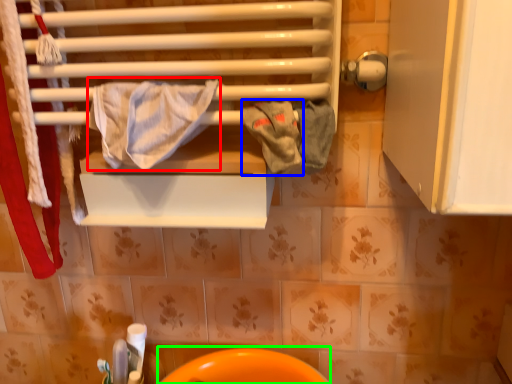
Question: Which object is the closest to the bath towel (highlighted by a red box)? Choose among these: bath towel (highlighted by a blue box) or sink (highlighted by a green box).

Choices:
 (A) bath towel
 (B) sink

Answer: (A)